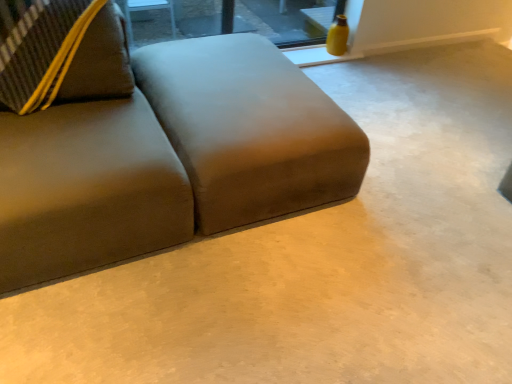
Question: From the image's perspective, is transparent glass window at upper center beneath suede-like brown couch at left?

Choices:
 (A) yes
 (B) no

Answer: (B)

Question: From a real-world perspective, is transparent glass window at upper center positioned over suede-like brown couch at left based on gravity?

Choices:
 (A) no
 (B) yes

Answer: (A)

Question: Would you say transparent glass window at upper center is a long distance from suede-like brown couch at left?

Choices:
 (A) yes
 (B) no

Answer: (A)

Question: Is transparent glass window at upper center positioned before suede-like brown couch at left?

Choices:
 (A) yes
 (B) no

Answer: (B)

Question: Is transparent glass window at upper center shorter than suede-like brown couch at left?

Choices:
 (A) yes
 (B) no

Answer: (A)

Question: Considering the relative sizes of transparent glass window at upper center and suede-like brown couch at left in the image provided, is transparent glass window at upper center wider than suede-like brown couch at left?

Choices:
 (A) no
 (B) yes

Answer: (A)

Question: From the image's perspective, is suede-like brown couch at left located beneath transparent glass window at upper center?

Choices:
 (A) yes
 (B) no

Answer: (A)

Question: Does suede-like brown couch at left appear on the right side of transparent glass window at upper center?

Choices:
 (A) yes
 (B) no

Answer: (B)

Question: Does suede-like brown couch at left have a lesser width compared to transparent glass window at upper center?

Choices:
 (A) yes
 (B) no

Answer: (B)

Question: Is suede-like brown couch at left facing away from transparent glass window at upper center?

Choices:
 (A) yes
 (B) no

Answer: (B)

Question: Is suede-like brown couch at left not near transparent glass window at upper center?

Choices:
 (A) yes
 (B) no

Answer: (A)

Question: Is transparent glass window at upper center completely or partially inside suede-like brown couch at left?

Choices:
 (A) yes
 (B) no

Answer: (B)

Question: Considering their positions, is suede-like brown couch at left located in front of or behind transparent glass window at upper center?

Choices:
 (A) front
 (B) behind

Answer: (A)